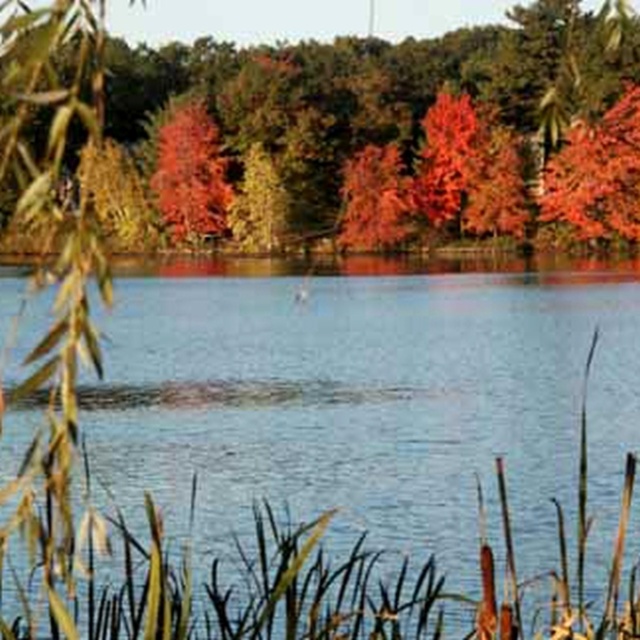
Question: Considering the relative positions of clear water at center and autumn leaves at upper center in the image provided, where is clear water at center located with respect to autumn leaves at upper center?

Choices:
 (A) below
 (B) above

Answer: (A)

Question: Considering the relative positions of clear water at center and autumn leaves at upper center in the image provided, where is clear water at center located with respect to autumn leaves at upper center?

Choices:
 (A) right
 (B) left

Answer: (B)

Question: Which point appears farthest from the camera in this image?

Choices:
 (A) (337, 356)
 (B) (605, 81)

Answer: (B)

Question: Is clear water at center closer to the viewer compared to autumn leaves at upper center?

Choices:
 (A) yes
 (B) no

Answer: (B)